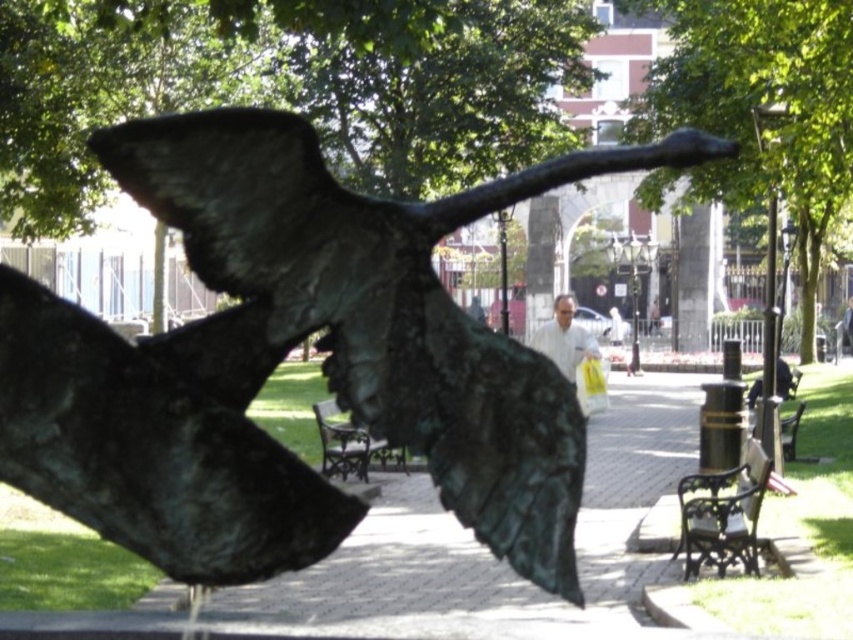
You are a photographer trying to capture the bronze sculpture of a bird in mid flight. You see the wooden park bench at center and the white shirt at center in the background. Which object is closer to the sculpture?

The wooden park bench at center is closer to the sculpture because the white shirt at center is behind it.

You are standing at the entrance of the park and want to find the bronze sculpture at center. Based on the coordinates provided, which direction should you walk to locate it?

The bronze sculpture at center is located at coordinates point (x=283, y=355), so you should walk towards the center of the park to find it.

You are a photographer trying to capture the bronze sculpture of a bird in mid flight. You are standing at the edge of the park pathway. You want to ensure that both the wooden park bench at center and the white shirt at center are visible in your photo. Given their sizes, which object should you focus on to frame the shot properly?

The wooden park bench at center is smaller than the white shirt at center. To frame the shot properly, focus on the white shirt at center since it is larger and will be more visible in the photo.